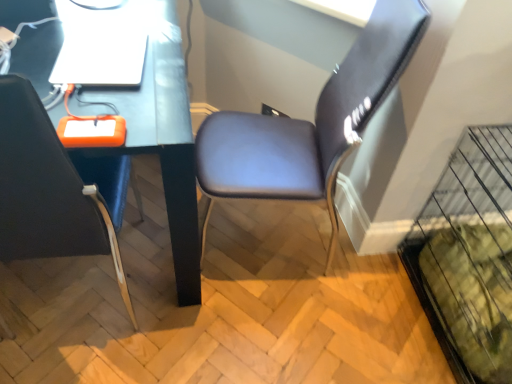
Question: Does matte black desk at center have a lesser width compared to suede-like brown chair at center-right, which is counted as the 1th chair, starting from the right?

Choices:
 (A) no
 (B) yes

Answer: (A)

Question: Considering the relative positions of matte black desk at center and suede-like brown chair at center-right, which is counted as the 1th chair, starting from the right, in the image provided, is matte black desk at center to the right of suede-like brown chair at center-right, which is counted as the 1th chair, starting from the right, from the viewer's perspective?

Choices:
 (A) yes
 (B) no

Answer: (B)

Question: Is matte black desk at center located outside suede-like brown chair at center-right, which is counted as the 1th chair, starting from the right?

Choices:
 (A) yes
 (B) no

Answer: (A)

Question: Does matte black desk at center contain suede-like brown chair at center-right, which appears as the 2th chair when viewed from the left?

Choices:
 (A) no
 (B) yes

Answer: (A)

Question: Does matte black desk at center have a greater height compared to suede-like brown chair at center-right, which is counted as the 1th chair, starting from the right?

Choices:
 (A) yes
 (B) no

Answer: (B)

Question: Choose the correct answer: Is matte black desk at center inside suede-like brown chair at center-right, which is counted as the 1th chair, starting from the right, or outside it?

Choices:
 (A) inside
 (B) outside

Answer: (B)

Question: From their relative heights in the image, would you say matte black desk at center is taller or shorter than suede-like brown chair at center-right, which appears as the 2th chair when viewed from the left?

Choices:
 (A) tall
 (B) short

Answer: (B)

Question: In the image, is matte black desk at center positioned in front of or behind suede-like brown chair at center-right, which is counted as the 1th chair, starting from the right?

Choices:
 (A) front
 (B) behind

Answer: (A)

Question: From the image's perspective, is matte black desk at center positioned above or below suede-like brown chair at center-right, which is counted as the 1th chair, starting from the right?

Choices:
 (A) above
 (B) below

Answer: (B)

Question: Relative to matte black desk at center, is white glossy laptop at upper left in front or behind?

Choices:
 (A) behind
 (B) front

Answer: (A)

Question: In the image, is white glossy laptop at upper left on the left side or the right side of matte black desk at center?

Choices:
 (A) left
 (B) right

Answer: (B)

Question: Based on their sizes in the image, would you say white glossy laptop at upper left is bigger or smaller than matte black desk at center?

Choices:
 (A) big
 (B) small

Answer: (B)

Question: Considering the positions of white glossy laptop at upper left and matte black desk at center in the image, is white glossy laptop at upper left wider or thinner than matte black desk at center?

Choices:
 (A) wide
 (B) thin

Answer: (B)

Question: Is matte black chair at left, placed as the 2th chair when sorted from right to left, inside or outside of suede-like brown chair at center-right, which appears as the 2th chair when viewed from the left?

Choices:
 (A) inside
 (B) outside

Answer: (B)

Question: Based on their sizes in the image, would you say matte black chair at left, placed as the 2th chair when sorted from right to left, is bigger or smaller than suede-like brown chair at center-right, which appears as the 2th chair when viewed from the left?

Choices:
 (A) big
 (B) small

Answer: (A)